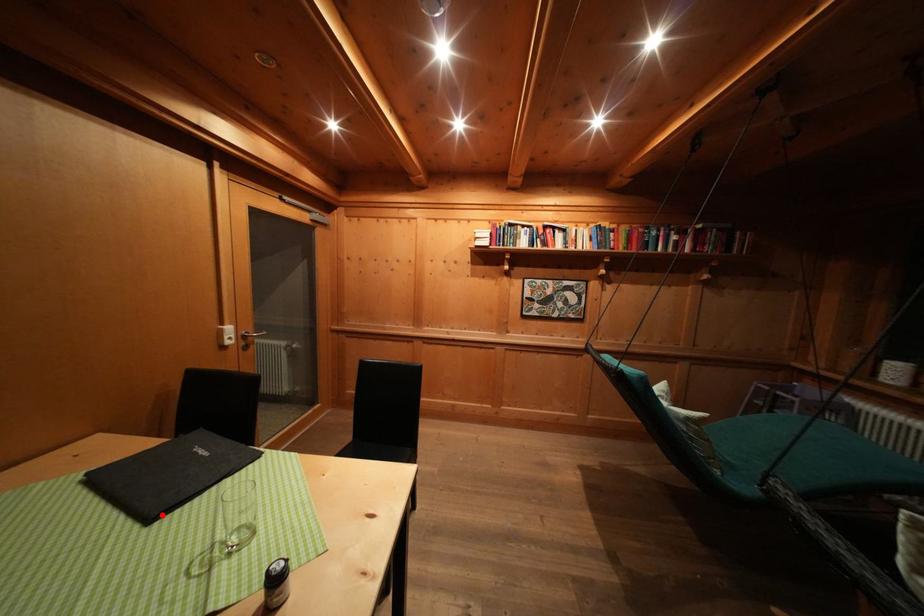
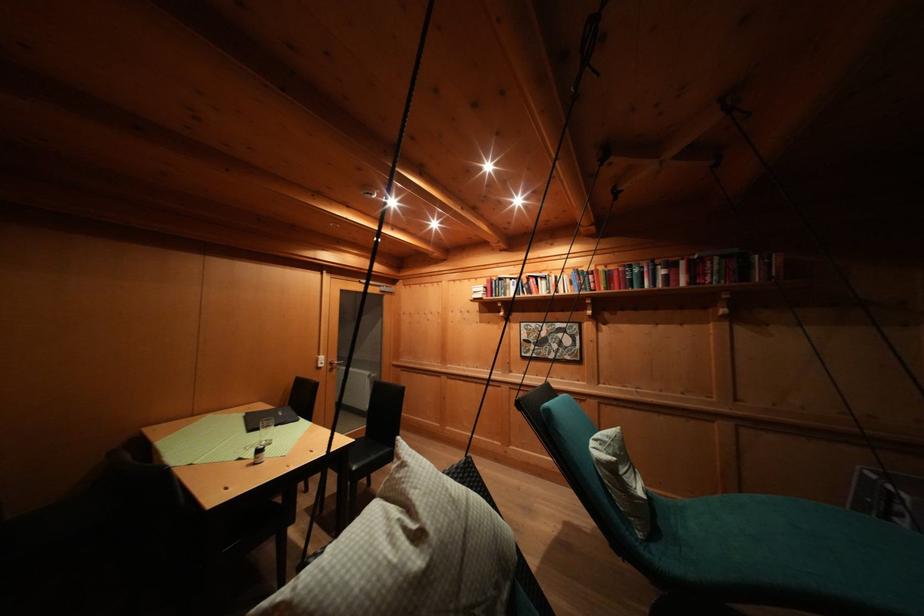
In the second image, find the point that corresponds to the highlighted location in the first image.

(259, 434)